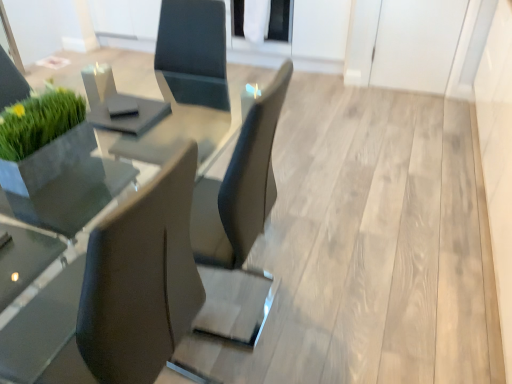
Question: Should I look upward or downward to see clear glass table at center?

Choices:
 (A) down
 (B) up

Answer: (A)

Question: Is matte black chair at left at the back of transparent glass door at upper center?

Choices:
 (A) no
 (B) yes

Answer: (A)

Question: Is transparent glass door at upper center aimed at matte black chair at left?

Choices:
 (A) no
 (B) yes

Answer: (B)

Question: Is transparent glass door at upper center to the left of matte black chair at left from the viewer's perspective?

Choices:
 (A) no
 (B) yes

Answer: (A)

Question: Considering the relative sizes of transparent glass door at upper center and matte black chair at left in the image provided, is transparent glass door at upper center thinner than matte black chair at left?

Choices:
 (A) yes
 (B) no

Answer: (B)

Question: Is transparent glass door at upper center at the right side of matte black chair at left?

Choices:
 (A) yes
 (B) no

Answer: (A)

Question: Is transparent glass door at upper center further to camera compared to matte black chair at left?

Choices:
 (A) no
 (B) yes

Answer: (B)

Question: From a real-world perspective, is matte black chair at left under transparent glass door at upper center?

Choices:
 (A) no
 (B) yes

Answer: (A)

Question: From the image's perspective, is matte black chair at left over transparent glass door at upper center?

Choices:
 (A) yes
 (B) no

Answer: (B)

Question: Does matte black chair at left contain transparent glass door at upper center?

Choices:
 (A) no
 (B) yes

Answer: (A)

Question: Is matte black chair at left oriented away from transparent glass door at upper center?

Choices:
 (A) no
 (B) yes

Answer: (A)

Question: From the image's perspective, is matte black chair at left located beneath transparent glass door at upper center?

Choices:
 (A) no
 (B) yes

Answer: (B)

Question: Can you confirm if matte black chair at left is positioned to the left of transparent glass door at upper center?

Choices:
 (A) yes
 (B) no

Answer: (A)

Question: Does clear glass table at center appear on the right side of transparent glass door at upper center?

Choices:
 (A) yes
 (B) no

Answer: (B)